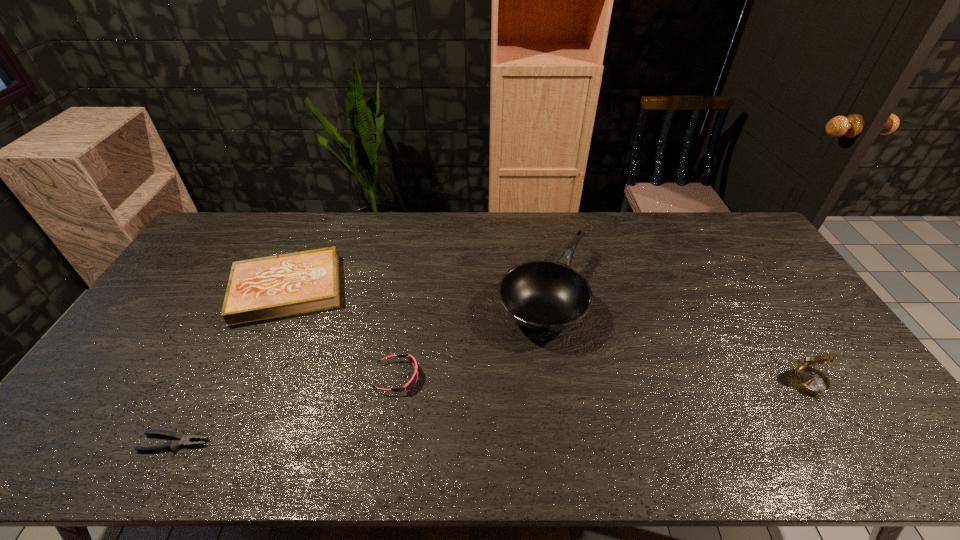
Locate an element on the screen. Image resolution: width=960 pixels, height=540 pixels. the second object from right to left is located at coordinates (545, 296).

Where is `the rightmost object`? The width and height of the screenshot is (960, 540). the rightmost object is located at coordinates (810, 380).

The height and width of the screenshot is (540, 960). In order to click on the third shortest object in this screenshot , I will do `click(259, 289)`.

The image size is (960, 540). What are the coordinates of `goggles` in the screenshot? It's located at (412, 382).

Where is `the third object from right to left`? The height and width of the screenshot is (540, 960). the third object from right to left is located at coordinates (412, 382).

At what (x,y) coordinates should I click in order to perform the action: click on pliers. Please return your answer as a coordinate pair (x, y). The image size is (960, 540). Looking at the image, I should click on (181, 439).

The height and width of the screenshot is (540, 960). What are the coordinates of `the shortest object` in the screenshot? It's located at (181, 439).

Where is `free space located 0.130m on the front of the frying pan`? The width and height of the screenshot is (960, 540). free space located 0.130m on the front of the frying pan is located at coordinates (558, 389).

Where is `free spot located 0.140m with the dial facing the compass`? free spot located 0.140m with the dial facing the compass is located at coordinates (855, 455).

Where is `vacant space located on the right of the hardback book`? The height and width of the screenshot is (540, 960). vacant space located on the right of the hardback book is located at coordinates (458, 289).